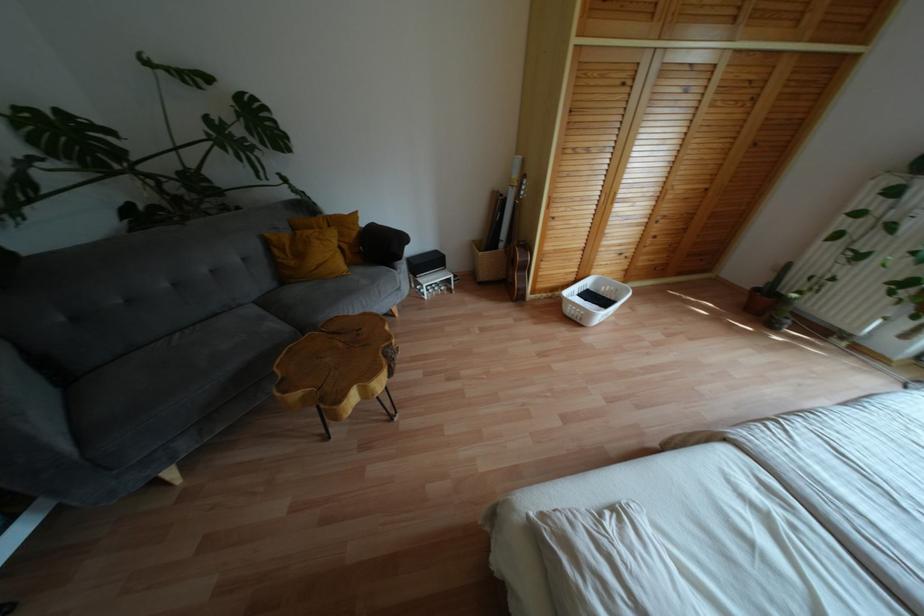
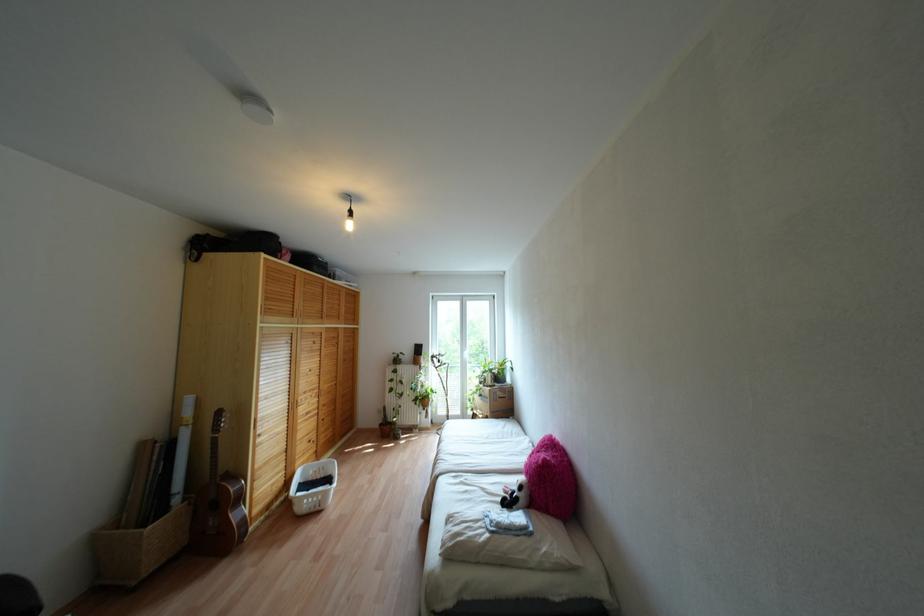
The point at (539, 273) is marked in the first image. Where is the corresponding point in the second image?

(253, 495)